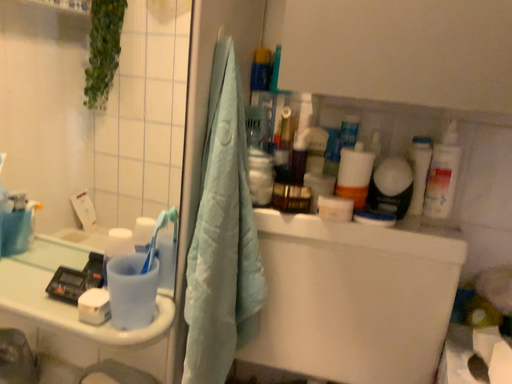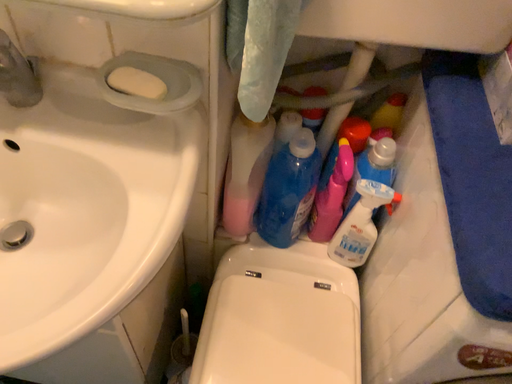
Question: How did the camera likely rotate when shooting the video?

Choices:
 (A) rotated downward
 (B) rotated upward

Answer: (A)